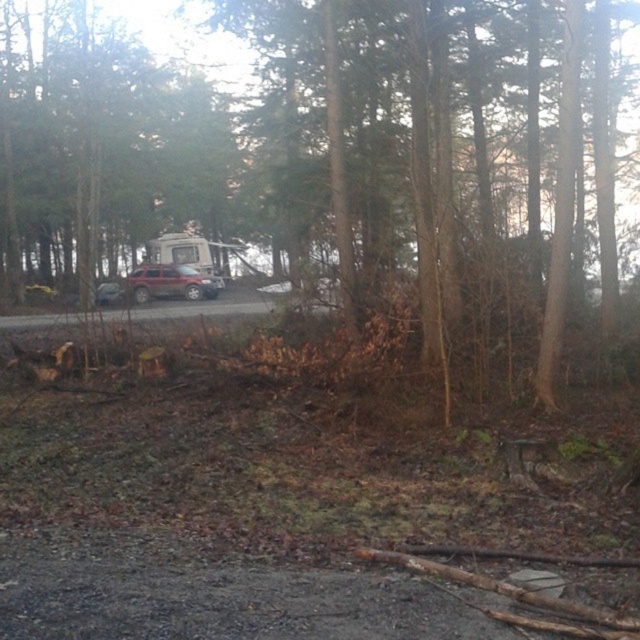
You are a hiker standing on the dirt path and see the brown rough tree trunk at center and the satin silver suv at center. Which object is nearer to you?

The brown rough tree trunk at center is closer to the viewer than the satin silver suv at center, so the brown rough tree trunk at center is nearer to you.

From the picture: You are driving a truck that is 10 feet long and want to park it between the rustic metallic jeep at center and the satin silver suv at center. Is there enough space between them to fit your truck?

The rustic metallic jeep at center and the satin silver suv at center are 9.61 feet apart from each other. Since your truck is 10 feet long, there is not enough space to park between them.